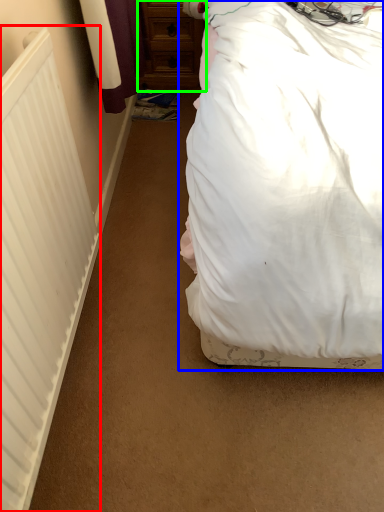
Question: Based on their relative distances, which object is nearer to radiator (highlighted by a red box)? Choose from bed (highlighted by a blue box) and chest of drawers (highlighted by a green box).

Choices:
 (A) bed
 (B) chest of drawers

Answer: (A)